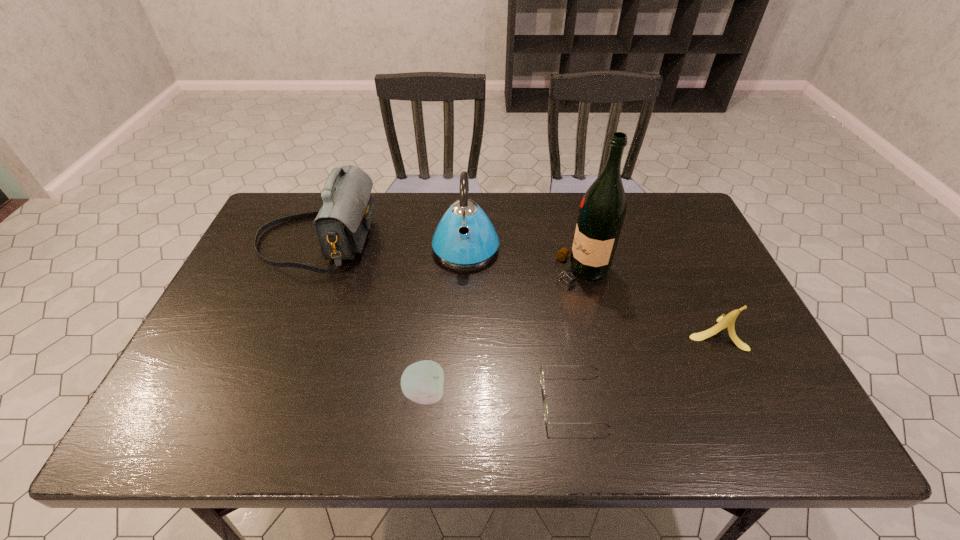
What are the coordinates of `vacant region located at the spout of the kettle` in the screenshot? It's located at (462, 372).

The image size is (960, 540). Identify the location of free region located 0.270m on the front of the shoulder bag. (269, 356).

Where is `vacant space located on the back of the banana`? The height and width of the screenshot is (540, 960). vacant space located on the back of the banana is located at coordinates (675, 248).

Image resolution: width=960 pixels, height=540 pixels. I want to click on vacant space located on the right of the apple, so click(x=620, y=393).

Find the location of a particular element. The image size is (960, 540). vacant space located 0.190m on the front-facing side of the sunglasses is located at coordinates (456, 400).

In order to click on vacant space located on the front-facing side of the sunglasses in this screenshot , I will do `click(411, 400)`.

Image resolution: width=960 pixels, height=540 pixels. I want to click on vacant region located 0.130m on the front-facing side of the sunglasses, so click(483, 400).

The height and width of the screenshot is (540, 960). I want to click on kettle that is at the far edge, so click(x=465, y=237).

The image size is (960, 540). Find the location of `shoulder bag that is at the far edge`. shoulder bag that is at the far edge is located at coordinates (342, 223).

The height and width of the screenshot is (540, 960). Identify the location of apple that is at the near edge. (422, 382).